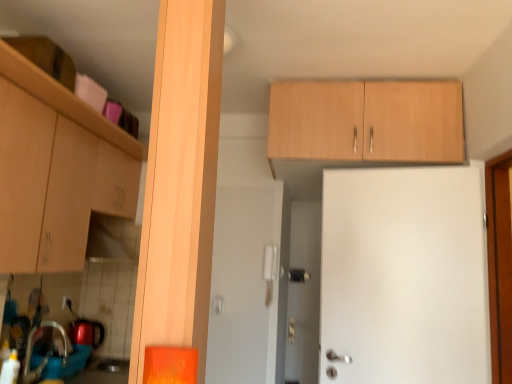
Question: Is light wood cabinet at upper center, arranged as the 1th cabinetry when viewed from the right, oriented towards matte wood cabinet at left, acting as the first cabinetry starting from the left?

Choices:
 (A) yes
 (B) no

Answer: (B)

Question: Is light wood cabinet at upper center, marked as the 2th cabinetry in a left-to-right arrangement, bigger than matte wood cabinet at left, the 2th cabinetry from the right?

Choices:
 (A) no
 (B) yes

Answer: (A)

Question: Is light wood cabinet at upper center, marked as the 2th cabinetry in a left-to-right arrangement, at the right side of matte wood cabinet at left, the 2th cabinetry from the right?

Choices:
 (A) yes
 (B) no

Answer: (A)

Question: Considering the relative sizes of light wood cabinet at upper center, arranged as the 1th cabinetry when viewed from the right, and matte wood cabinet at left, the 2th cabinetry from the right, in the image provided, is light wood cabinet at upper center, arranged as the 1th cabinetry when viewed from the right, taller than matte wood cabinet at left, the 2th cabinetry from the right,?

Choices:
 (A) yes
 (B) no

Answer: (B)

Question: From a real-world perspective, is light wood cabinet at upper center, marked as the 2th cabinetry in a left-to-right arrangement, below matte wood cabinet at left, the 2th cabinetry from the right?

Choices:
 (A) no
 (B) yes

Answer: (A)

Question: Is point (69, 309) closer or farther from the camera than point (69, 357)?

Choices:
 (A) closer
 (B) farther

Answer: (B)

Question: Would you say white plastic electric outlet at lower left is inside or outside brushed metal sink at lower left?

Choices:
 (A) inside
 (B) outside

Answer: (B)

Question: Based on their sizes in the image, would you say white plastic electric outlet at lower left is bigger or smaller than brushed metal sink at lower left?

Choices:
 (A) small
 (B) big

Answer: (A)

Question: Visually, is white plastic electric outlet at lower left positioned to the left or to the right of brushed metal sink at lower left?

Choices:
 (A) left
 (B) right

Answer: (A)

Question: Is white plastic electric outlet at lower left situated inside matte wood cabinet at left, the 2th cabinetry from the right, or outside?

Choices:
 (A) outside
 (B) inside

Answer: (A)

Question: Based on their sizes in the image, would you say white plastic electric outlet at lower left is bigger or smaller than matte wood cabinet at left, acting as the first cabinetry starting from the left?

Choices:
 (A) big
 (B) small

Answer: (B)

Question: From the image's perspective, relative to matte wood cabinet at left, acting as the first cabinetry starting from the left, is white plastic electric outlet at lower left above or below?

Choices:
 (A) below
 (B) above

Answer: (A)

Question: Based on their positions, is white plastic electric outlet at lower left located to the left or right of matte wood cabinet at left, acting as the first cabinetry starting from the left?

Choices:
 (A) left
 (B) right

Answer: (A)

Question: In terms of width, does matte wood cabinet at left, acting as the first cabinetry starting from the left, look wider or thinner when compared to brushed metal sink at lower left?

Choices:
 (A) wide
 (B) thin

Answer: (A)

Question: Visually, is matte wood cabinet at left, acting as the first cabinetry starting from the left, positioned to the left or to the right of brushed metal sink at lower left?

Choices:
 (A) left
 (B) right

Answer: (A)